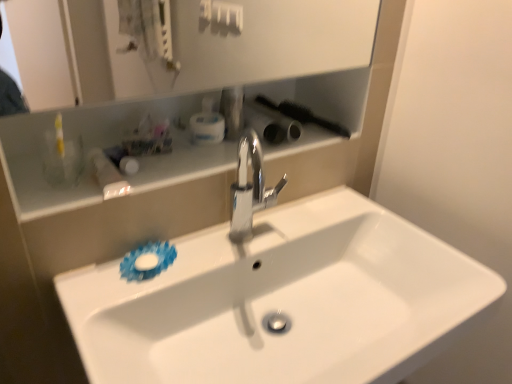
You are a GUI agent. You are given a task and a screenshot of the screen. Output one action in this format:
    pyautogui.click(x=<x>, y=<y>)
    Task: Click on the free space in front of metallic silver faucet at center, arranged as the third toiletry when viewed from the left
    
    Given the screenshot: What is the action you would take?
    pyautogui.click(x=205, y=158)